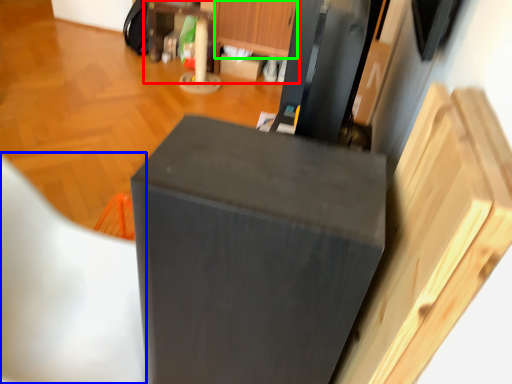
Question: Estimate the real-world distances between objects in this image. Which object is closer to dresser (highlighted by a red box), folding chair (highlighted by a blue box) or drawer (highlighted by a green box)?

Choices:
 (A) folding chair
 (B) drawer

Answer: (B)